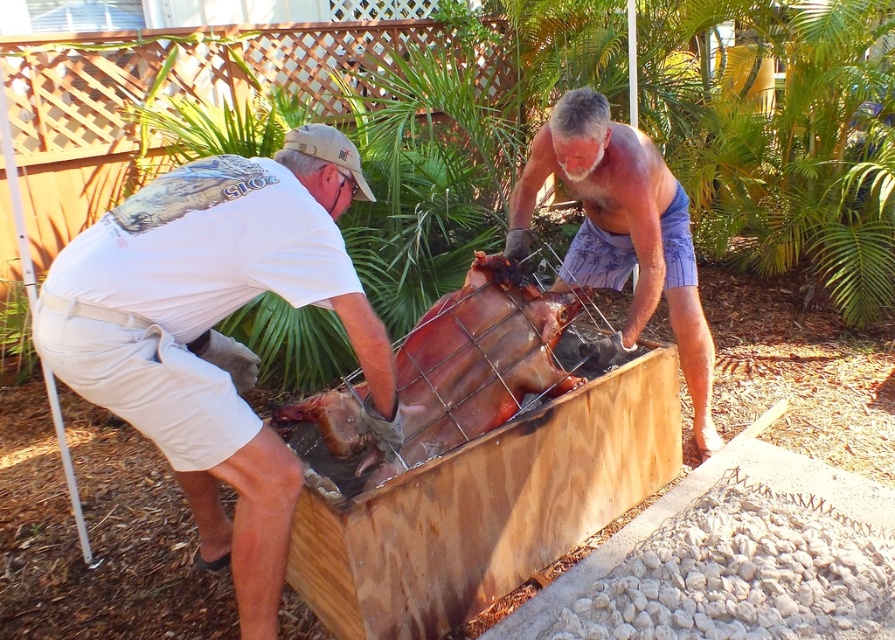
Question: Which point is farther from the camera taking this photo?

Choices:
 (A) (351, 442)
 (B) (252, 296)

Answer: (A)

Question: Does white cotton shirt at left have a smaller size compared to beige textured shorts at center?

Choices:
 (A) no
 (B) yes

Answer: (A)

Question: Is white cotton shirt at left closer to camera compared to beige textured shorts at center?

Choices:
 (A) no
 (B) yes

Answer: (B)

Question: Is white cotton shirt at left to the right of brown leather skin at center from the viewer's perspective?

Choices:
 (A) no
 (B) yes

Answer: (A)

Question: Based on their relative distances, which object is nearer to the beige textured shorts at center?

Choices:
 (A) white cotton shirt at left
 (B) brown leather skin at center

Answer: (B)

Question: Which point is farther to the camera?

Choices:
 (A) beige textured shorts at center
 (B) white cotton shirt at left

Answer: (A)